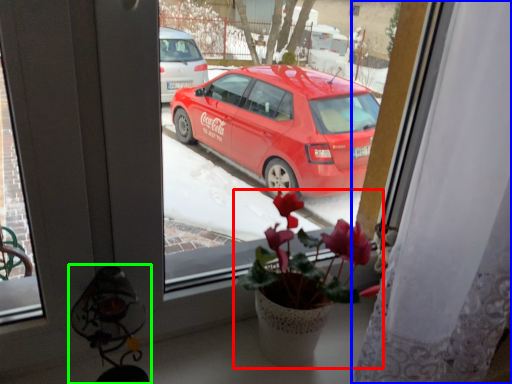
Question: Which is nearer to the houseplant (highlighted by a red box)? curtain (highlighted by a blue box) or lamp (highlighted by a green box).

Choices:
 (A) curtain
 (B) lamp

Answer: (A)